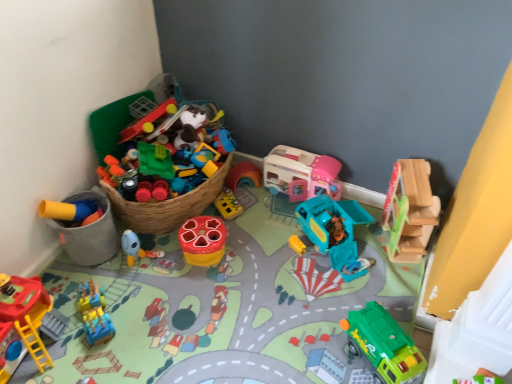
Question: Is blue rubber duck at center, which ranks as the sixth toy in right-to-left order, wider than teal plastic truck at center, which is the 6th toy in left-to-right order?

Choices:
 (A) yes
 (B) no

Answer: (B)

Question: Does blue rubber duck at center, which ranks as the sixth toy in right-to-left order, have a smaller size compared to teal plastic truck at center, which is the 6th toy in left-to-right order?

Choices:
 (A) no
 (B) yes

Answer: (B)

Question: Considering the relative sizes of blue rubber duck at center, which ranks as the sixth toy in right-to-left order, and teal plastic truck at center, which ranks as the third toy in right-to-left order, in the image provided, is blue rubber duck at center, which ranks as the sixth toy in right-to-left order, thinner than teal plastic truck at center, which ranks as the third toy in right-to-left order,?

Choices:
 (A) no
 (B) yes

Answer: (B)

Question: Is blue rubber duck at center, which is the 3th toy in left-to-right order, placed right next to teal plastic truck at center, which ranks as the third toy in right-to-left order?

Choices:
 (A) no
 (B) yes

Answer: (A)

Question: Is blue rubber duck at center, which is the 3th toy in left-to-right order, shorter than teal plastic truck at center, which is the 6th toy in left-to-right order?

Choices:
 (A) no
 (B) yes

Answer: (A)

Question: Is teal plastic truck at center, which is the 6th toy in left-to-right order, inside the boundaries of rubberized yellow toy at left, which appears as the 8th toy when viewed from the right, or outside?

Choices:
 (A) outside
 (B) inside

Answer: (A)

Question: Is teal plastic truck at center, which ranks as the third toy in right-to-left order, bigger or smaller than rubberized yellow toy at left, which appears as the 8th toy when viewed from the right?

Choices:
 (A) small
 (B) big

Answer: (B)

Question: From their relative heights in the image, would you say teal plastic truck at center, which ranks as the third toy in right-to-left order, is taller or shorter than rubberized yellow toy at left, marked as the 1th toy in a left-to-right arrangement?

Choices:
 (A) short
 (B) tall

Answer: (A)

Question: From the image's perspective, is teal plastic truck at center, which ranks as the third toy in right-to-left order, above or below rubberized yellow toy at left, which appears as the 8th toy when viewed from the right?

Choices:
 (A) below
 (B) above

Answer: (B)

Question: From the image's perspective, is green matte truck at lower right, arranged as the second toy when viewed from the right, above or below blue plastic train at lower left, placed as the second toy when sorted from left to right?

Choices:
 (A) above
 (B) below

Answer: (B)

Question: From a real-world perspective, is green matte truck at lower right, which is the 7th toy from left to right, physically located above or below blue plastic train at lower left, acting as the seventh toy starting from the right?

Choices:
 (A) below
 (B) above

Answer: (B)

Question: Relative to blue plastic train at lower left, placed as the second toy when sorted from left to right, is green matte truck at lower right, arranged as the second toy when viewed from the right, in front or behind?

Choices:
 (A) front
 (B) behind

Answer: (A)

Question: Visually, is green matte truck at lower right, arranged as the second toy when viewed from the right, positioned to the left or to the right of blue plastic train at lower left, acting as the seventh toy starting from the right?

Choices:
 (A) left
 (B) right

Answer: (B)

Question: Is point (97, 339) closer or farther from the camera than point (404, 375)?

Choices:
 (A) closer
 (B) farther

Answer: (B)

Question: From the image's perspective, is blue plastic train at lower left, placed as the second toy when sorted from left to right, positioned above or below green matte truck at lower right, arranged as the second toy when viewed from the right?

Choices:
 (A) above
 (B) below

Answer: (A)